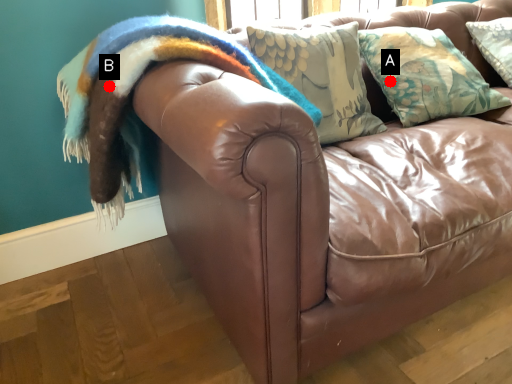
Question: Two points are circled on the image, labeled by A and B beside each circle. Which point appears closest to the camera in this image?

Choices:
 (A) A is closer
 (B) B is closer

Answer: (B)